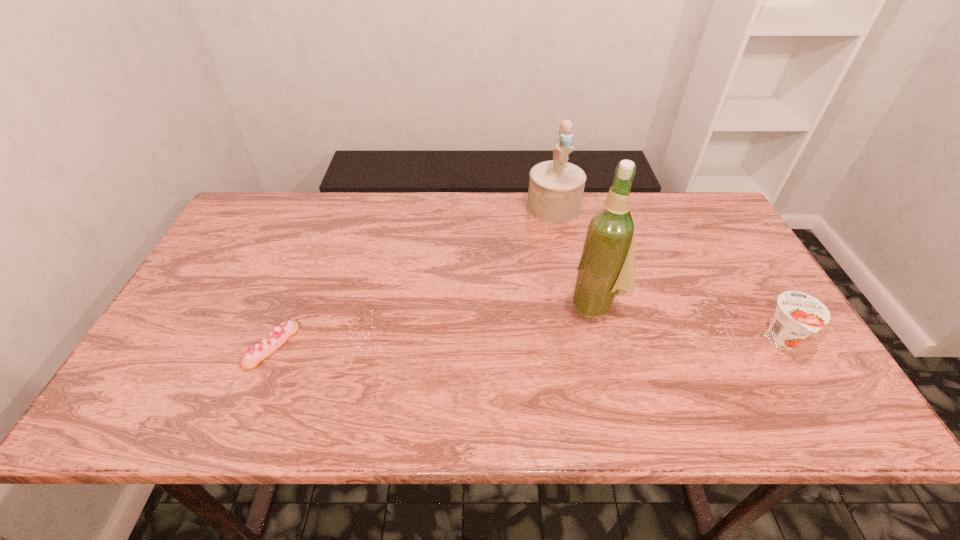
Image resolution: width=960 pixels, height=540 pixels. What are the coordinates of `vacant space at the far edge of the desktop` in the screenshot? It's located at (476, 212).

Locate an element on the screen. This screenshot has height=540, width=960. blank area at the near edge is located at coordinates (668, 380).

Find the location of a particular element. The image size is (960, 540). vacant region at the left edge is located at coordinates (250, 295).

Where is `vacant space at the right edge of the desktop`? This screenshot has width=960, height=540. vacant space at the right edge of the desktop is located at coordinates (753, 316).

Locate an element on the screen. The width and height of the screenshot is (960, 540). vacant area at the far left corner is located at coordinates (292, 202).

The width and height of the screenshot is (960, 540). I want to click on vacant space at the near right corner of the desktop, so click(x=777, y=363).

Where is `unoccupied area between the tallest object and the shortest object`? The height and width of the screenshot is (540, 960). unoccupied area between the tallest object and the shortest object is located at coordinates (434, 325).

Locate an element on the screen. The width and height of the screenshot is (960, 540). free spot between the wine bottle and the farthest object is located at coordinates (574, 256).

This screenshot has height=540, width=960. Identify the location of blank region between the figurine and the wine bottle. click(574, 256).

This screenshot has height=540, width=960. I want to click on free space between the tallest object and the farthest object, so click(x=574, y=256).